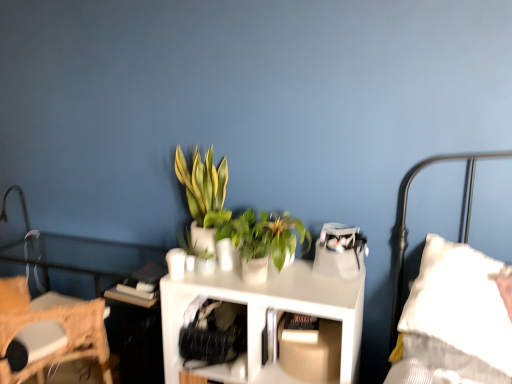
The width and height of the screenshot is (512, 384). Describe the element at coordinates (204, 196) in the screenshot. I see `green leafy plant at center, which appears as the first houseplant when viewed from the left` at that location.

Identify the location of green leafy plant at center, which appears as the first houseplant when viewed from the left. This screenshot has height=384, width=512. (204, 196).

Measure the distance between white matte table at center and camera.

A distance of 1.46 meters exists between white matte table at center and camera.

What is the approximate height of white matte table at center?

white matte table at center is 30.33 inches in height.

The height and width of the screenshot is (384, 512). I want to click on woven straw chair at left, so click(x=49, y=331).

What do you see at coordinates (263, 241) in the screenshot? The height and width of the screenshot is (384, 512). I see `green matte plant at center, which is counted as the 1th houseplant, starting from the right` at bounding box center [263, 241].

Describe the element at coordinates (21, 206) in the screenshot. I see `metallic silver table lamp at left` at that location.

Measure the distance between point [2,208] and camera.

The depth of point [2,208] is 7.93 feet.

Image resolution: width=512 pixels, height=384 pixels. Find the location of `green leafy plant at center, which appears as the first houseplant when viewed from the left`. green leafy plant at center, which appears as the first houseplant when viewed from the left is located at coordinates (204, 196).

Is metallic silver table lamp at left next to green leafy plant at center, arranged as the 2th houseplant when viewed from the right?

No, metallic silver table lamp at left is not making contact with green leafy plant at center, arranged as the 2th houseplant when viewed from the right.

From the image's perspective, between metallic silver table lamp at left and green leafy plant at center, which appears as the first houseplant when viewed from the left, who is located below?

metallic silver table lamp at left.

From a real-world perspective, does metallic silver table lamp at left stand above green leafy plant at center, which appears as the first houseplant when viewed from the left?

Incorrect, from a real-world perspective, metallic silver table lamp at left is lower than green leafy plant at center, which appears as the first houseplant when viewed from the left.

Can you confirm if woven straw chair at left is smaller than metallic silver table lamp at left?

No, woven straw chair at left is not smaller than metallic silver table lamp at left.

Which is more to the right, woven straw chair at left or metallic silver table lamp at left?

From the viewer's perspective, woven straw chair at left appears more on the right side.

Is metallic silver table lamp at left inside woven straw chair at left?

No, woven straw chair at left does not contain metallic silver table lamp at left.

Is green matte plant at center, which ranks as the second houseplant in left-to-right order, shorter than white matte table at center?

Indeed, green matte plant at center, which ranks as the second houseplant in left-to-right order, has a lesser height compared to white matte table at center.

Looking at this image, which object is closer to the camera taking this photo, green matte plant at center, which ranks as the second houseplant in left-to-right order, or white matte table at center?

white matte table at center is closer to the camera.

Looking at this image, could you tell me if green matte plant at center, which ranks as the second houseplant in left-to-right order, is facing white matte table at center?

No, green matte plant at center, which ranks as the second houseplant in left-to-right order, is not facing towards white matte table at center.

From the picture: Does green matte plant at center, which is counted as the 1th houseplant, starting from the right, have a greater width compared to white matte table at center?

Incorrect, the width of green matte plant at center, which is counted as the 1th houseplant, starting from the right, does not surpass that of white matte table at center.

Is green leafy plant at center, arranged as the 2th houseplant when viewed from the right, located outside white matte table at center?

Yes, green leafy plant at center, arranged as the 2th houseplant when viewed from the right, is not within white matte table at center.

Considering the sizes of objects green leafy plant at center, which appears as the first houseplant when viewed from the left, and white matte table at center in the image provided, who is shorter, green leafy plant at center, which appears as the first houseplant when viewed from the left, or white matte table at center?

Standing shorter between the two is green leafy plant at center, which appears as the first houseplant when viewed from the left.

How different are the orientations of green leafy plant at center, which appears as the first houseplant when viewed from the left, and white matte table at center in degrees?

There is a 4.56-degree angle between the facing directions of green leafy plant at center, which appears as the first houseplant when viewed from the left, and white matte table at center.

From the image's perspective, which one is positioned higher, green leafy plant at center, arranged as the 2th houseplant when viewed from the right, or white matte table at center?

green leafy plant at center, arranged as the 2th houseplant when viewed from the right, from the image's perspective.

Can you tell me how much green leafy plant at center, arranged as the 2th houseplant when viewed from the right, and woven straw chair at left differ in facing direction?

168 degrees.

Which of these two, green leafy plant at center, which appears as the first houseplant when viewed from the left, or woven straw chair at left, is smaller?

green leafy plant at center, which appears as the first houseplant when viewed from the left, is smaller.

From the image's perspective, would you say green leafy plant at center, which appears as the first houseplant when viewed from the left, is positioned over woven straw chair at left?

Yes, from the image's perspective, green leafy plant at center, which appears as the first houseplant when viewed from the left, is above woven straw chair at left.

Is green matte plant at center, which is counted as the 1th houseplant, starting from the right, with metallic silver table lamp at left?

No, green matte plant at center, which is counted as the 1th houseplant, starting from the right, is not touching metallic silver table lamp at left.

Find the location of a particular element. houseplant below the metallic silver table lamp at left (from the image's perspective) is located at coordinates 263,241.

Is green matte plant at center, which ranks as the second houseplant in left-to-right order, positioned behind metallic silver table lamp at left?

No, the depth of green matte plant at center, which ranks as the second houseplant in left-to-right order, is less than that of metallic silver table lamp at left.

Between green matte plant at center, which is counted as the 1th houseplant, starting from the right, and metallic silver table lamp at left, which one has more height?

metallic silver table lamp at left is taller.

How much distance is there between green leafy plant at center, arranged as the 2th houseplant when viewed from the right, and green matte plant at center, which ranks as the second houseplant in left-to-right order?

A distance of 7.59 inches exists between green leafy plant at center, arranged as the 2th houseplant when viewed from the right, and green matte plant at center, which ranks as the second houseplant in left-to-right order.

From the picture: Considering the sizes of green leafy plant at center, which appears as the first houseplant when viewed from the left, and green matte plant at center, which ranks as the second houseplant in left-to-right order, in the image, is green leafy plant at center, which appears as the first houseplant when viewed from the left, bigger or smaller than green matte plant at center, which ranks as the second houseplant in left-to-right order,?

In the image, green leafy plant at center, which appears as the first houseplant when viewed from the left, appears to be larger than green matte plant at center, which ranks as the second houseplant in left-to-right order.

Looking at this image, is green leafy plant at center, which appears as the first houseplant when viewed from the left, positioned with its back to green matte plant at center, which ranks as the second houseplant in left-to-right order?

green leafy plant at center, which appears as the first houseplant when viewed from the left, is not turned away from green matte plant at center, which ranks as the second houseplant in left-to-right order.

From a real-world perspective, which is physically above, green leafy plant at center, arranged as the 2th houseplant when viewed from the right, or green matte plant at center, which is counted as the 1th houseplant, starting from the right?

green leafy plant at center, arranged as the 2th houseplant when viewed from the right.

Locate an element on the screen. This screenshot has width=512, height=384. table lamp on the left side of green leafy plant at center, arranged as the 2th houseplant when viewed from the right is located at coordinates (21, 206).

Where is `chair in front of the metallic silver table lamp at left`? This screenshot has height=384, width=512. chair in front of the metallic silver table lamp at left is located at coordinates 49,331.

Estimate the real-world distances between objects in this image. Which object is closer to green leafy plant at center, which appears as the first houseplant when viewed from the left, white matte table at center or green matte plant at center, which ranks as the second houseplant in left-to-right order?

The object closer to green leafy plant at center, which appears as the first houseplant when viewed from the left, is green matte plant at center, which ranks as the second houseplant in left-to-right order.

Considering their positions, is metallic silver table lamp at left positioned closer to white matte table at center than green matte plant at center, which is counted as the 1th houseplant, starting from the right?

green matte plant at center, which is counted as the 1th houseplant, starting from the right.

Consider the image. Estimate the real-world distances between objects in this image. Which object is further from woven straw chair at left, metallic silver table lamp at left or white matte table at center?

metallic silver table lamp at left lies further to woven straw chair at left than the other object.

Which object lies nearer to the anchor point woven straw chair at left, white matte table at center or green leafy plant at center, which appears as the first houseplant when viewed from the left?

white matte table at center is positioned closer to the anchor woven straw chair at left.

Considering their positions, is woven straw chair at left positioned closer to metallic silver table lamp at left than green leafy plant at center, which appears as the first houseplant when viewed from the left?

woven straw chair at left is positioned closer to the anchor metallic silver table lamp at left.

Considering their positions, is metallic silver table lamp at left positioned further to white matte table at center than green leafy plant at center, arranged as the 2th houseplant when viewed from the right?

metallic silver table lamp at left is positioned further to the anchor white matte table at center.

Which object lies further to the anchor point woven straw chair at left, white matte table at center or green matte plant at center, which is counted as the 1th houseplant, starting from the right?

The object further to woven straw chair at left is green matte plant at center, which is counted as the 1th houseplant, starting from the right.

Looking at the image, which one is located closer to woven straw chair at left, green matte plant at center, which ranks as the second houseplant in left-to-right order, or green leafy plant at center, which appears as the first houseplant when viewed from the left?

green leafy plant at center, which appears as the first houseplant when viewed from the left, is positioned closer to the anchor woven straw chair at left.

Where is `chair situated between metallic silver table lamp at left and white matte table at center from left to right`? chair situated between metallic silver table lamp at left and white matte table at center from left to right is located at coordinates (49, 331).

Find the location of a particular element. houseplant between woven straw chair at left and white matte table at center from left to right is located at coordinates (204, 196).

Find the location of a particular element. This screenshot has width=512, height=384. table situated between metallic silver table lamp at left and green matte plant at center, which ranks as the second houseplant in left-to-right order, from left to right is located at coordinates (264, 315).

Locate an element on the screen. The image size is (512, 384). table located between woven straw chair at left and green matte plant at center, which is counted as the 1th houseplant, starting from the right, in the left-right direction is located at coordinates (264, 315).